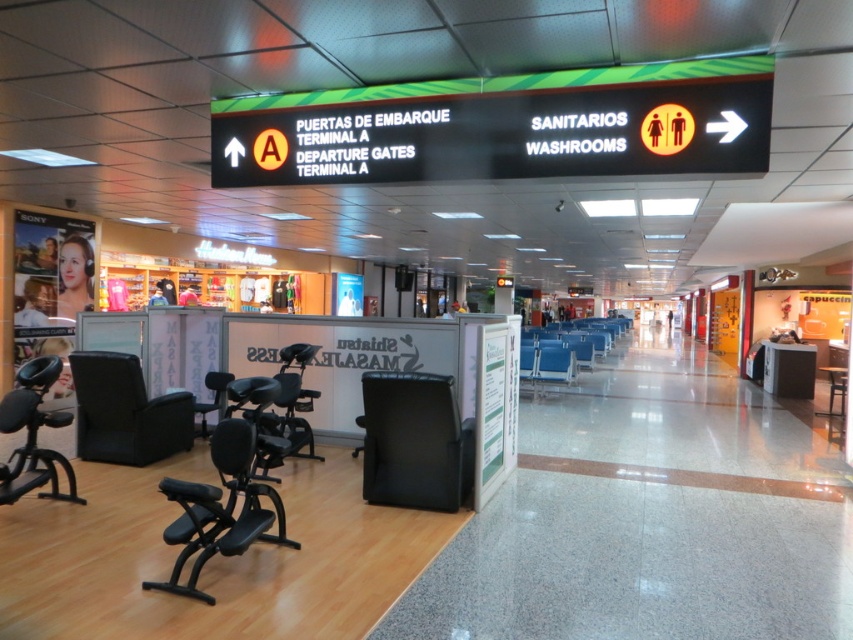
You are a traveler sitting on the black matte swivel chair at lower left and want to reach the black matte exercise chair at lower left. Can you stand up and move to it without moving the exercise chair?

The black matte swivel chair at lower left is positioned under the black matte exercise chair at lower left, so you cannot stand up and move to it without moving the exercise chair because the swivel chair is directly underneath it.

You are a traveler sitting on the black leather chair at center and need to reach the black matte swivel chair at lower left. Can you step down directly to it without moving around the furniture?

The black leather chair at center is positioned over the black matte swivel chair at lower left, so stepping down directly to it would be possible since they are vertically aligned.

You are a traveler carrying a heavy suitcase and need to rest. You see a black matte swivel chair at lower left and a black matte exercise chair at lower left. Which chair would be more suitable for sitting comfortably with your luggage?

The black matte exercise chair at lower left is taller, so it would be more suitable for sitting comfortably with your heavy suitcase as it provides a higher seat for easier access.